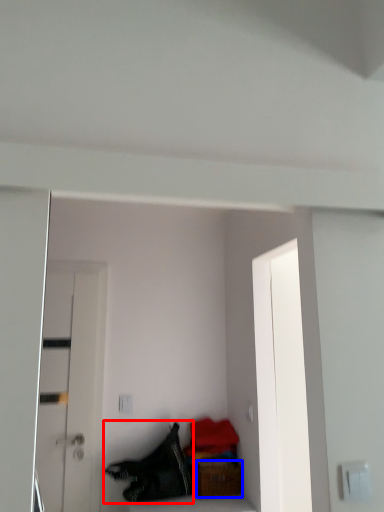
Question: Which of the following is the farthest to the observer, clothing (highlighted by a red box) or furniture (highlighted by a blue box)?

Choices:
 (A) clothing
 (B) furniture

Answer: (B)